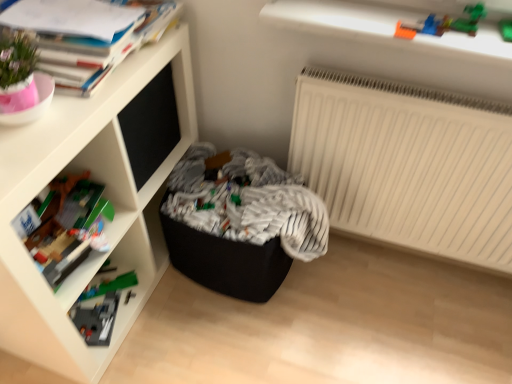
Question: Can you confirm if black fabric laundry at center is taller than matte paper book at upper left?

Choices:
 (A) no
 (B) yes

Answer: (B)

Question: Does black fabric laundry at center have a smaller size compared to matte paper book at upper left?

Choices:
 (A) yes
 (B) no

Answer: (B)

Question: Does black fabric laundry at center turn towards matte paper book at upper left?

Choices:
 (A) yes
 (B) no

Answer: (B)

Question: Considering the relative sizes of black fabric laundry at center and matte paper book at upper left in the image provided, is black fabric laundry at center wider than matte paper book at upper left?

Choices:
 (A) yes
 (B) no

Answer: (A)

Question: Is the position of black fabric laundry at center less distant than that of matte paper book at upper left?

Choices:
 (A) no
 (B) yes

Answer: (A)

Question: Does point (81, 84) appear closer or farther from the camera than point (391, 226)?

Choices:
 (A) closer
 (B) farther

Answer: (A)

Question: Choose the correct answer: Is matte paper book at upper left inside white matte radiator at upper right or outside it?

Choices:
 (A) inside
 (B) outside

Answer: (B)

Question: Is matte paper book at upper left in front of or behind white matte radiator at upper right in the image?

Choices:
 (A) front
 (B) behind

Answer: (A)

Question: Is matte paper book at upper left bigger or smaller than white matte radiator at upper right?

Choices:
 (A) big
 (B) small

Answer: (B)

Question: Is white matte radiator at upper right in front of or behind matte paper book at upper left in the image?

Choices:
 (A) front
 (B) behind

Answer: (B)

Question: In terms of width, does white matte radiator at upper right look wider or thinner when compared to matte paper book at upper left?

Choices:
 (A) wide
 (B) thin

Answer: (B)

Question: Would you say white matte radiator at upper right is inside or outside matte paper book at upper left?

Choices:
 (A) outside
 (B) inside

Answer: (A)

Question: From the image's perspective, is white matte radiator at upper right above or below matte paper book at upper left?

Choices:
 (A) below
 (B) above

Answer: (A)

Question: Is point (118, 165) positioned closer to the camera than point (268, 218)?

Choices:
 (A) farther
 (B) closer

Answer: (B)

Question: Is white matte shelf at upper left to the left or to the right of black fabric laundry at center in the image?

Choices:
 (A) right
 (B) left

Answer: (B)